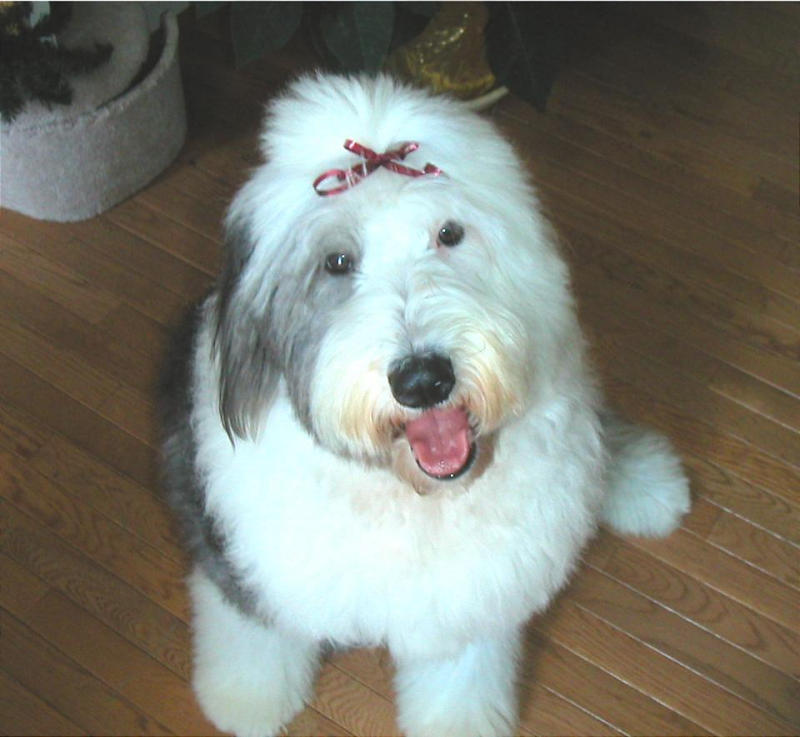
The width and height of the screenshot is (800, 737). I want to click on basket, so click(x=94, y=177).